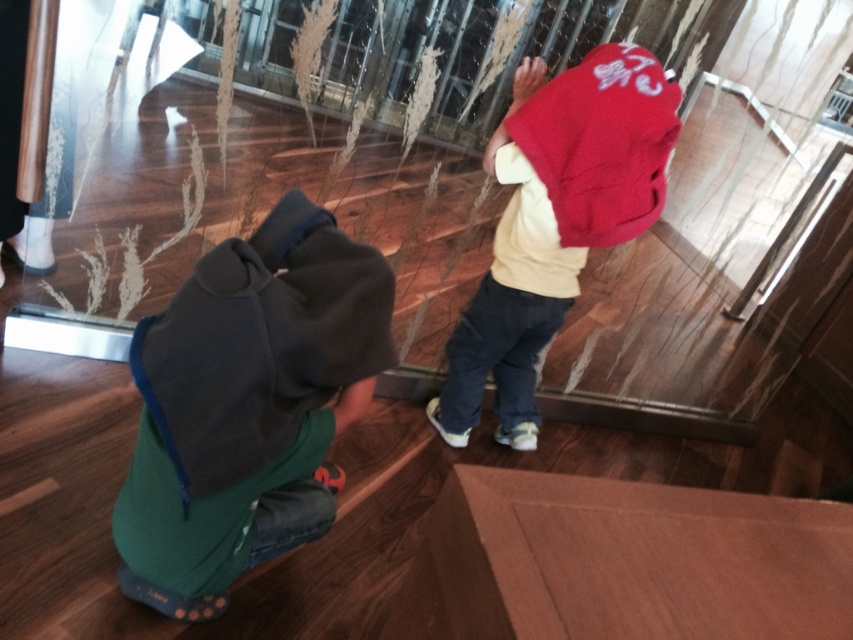
What do you see at coordinates (412, 156) in the screenshot?
I see `transparent glass door at center` at bounding box center [412, 156].

Does transparent glass door at center appear under dark gray fleece jacket at lower left?

No.

Describe the element at coordinates (412, 156) in the screenshot. This screenshot has height=640, width=853. I see `transparent glass door at center` at that location.

Identify the location of transparent glass door at center. (412, 156).

Who is more forward, (486, 236) or (490, 164)?

Point (490, 164) is in front.

Is transparent glass door at center below red fleece jacket at center?

Actually, transparent glass door at center is above red fleece jacket at center.

What do you see at coordinates (412, 156) in the screenshot? Image resolution: width=853 pixels, height=640 pixels. I see `transparent glass door at center` at bounding box center [412, 156].

This screenshot has width=853, height=640. Find the location of `transparent glass door at center`. transparent glass door at center is located at coordinates (412, 156).

Between dark gray fleece jacket at lower left and red fleece jacket at center, which one has more height?

red fleece jacket at center

Does dark gray fleece jacket at lower left appear on the right side of red fleece jacket at center?

No, dark gray fleece jacket at lower left is not to the right of red fleece jacket at center.

Is point (196, 310) closer to camera compared to point (526, 93)?

Yes, point (196, 310) is closer to viewer.

At what (x,y) coordinates should I click in order to perform the action: click on dark gray fleece jacket at lower left. Please return your answer as a coordinate pair (x, y). Image resolution: width=853 pixels, height=640 pixels. Looking at the image, I should click on (260, 342).